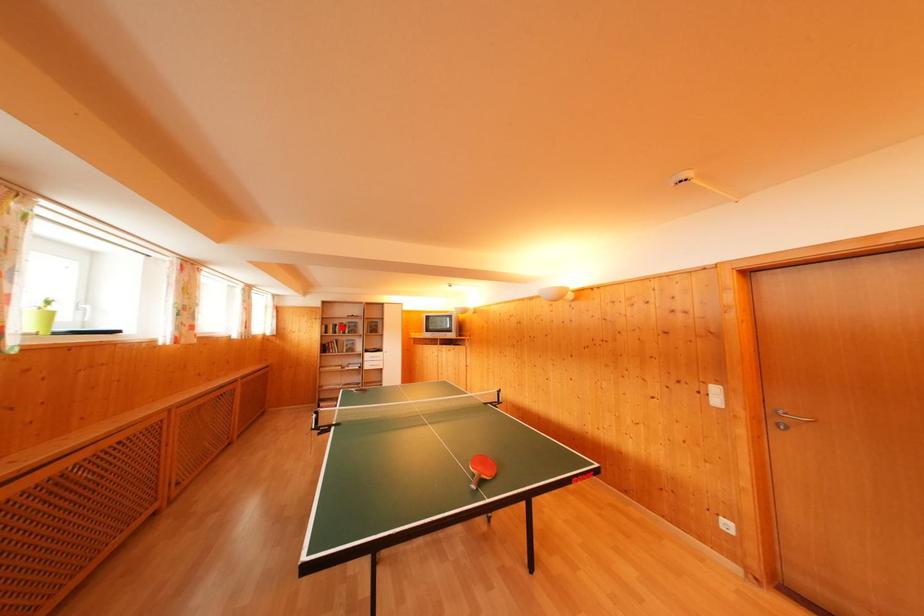
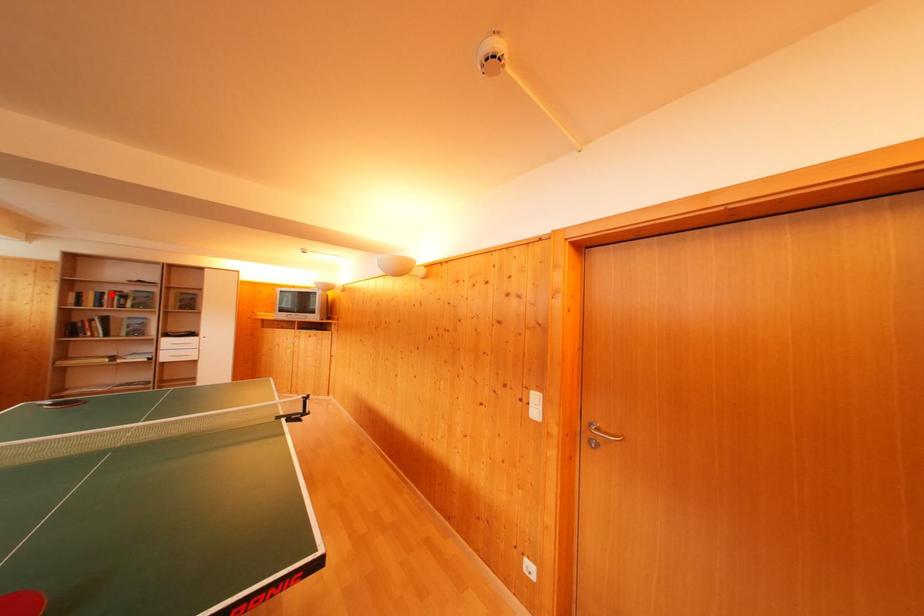
I am providing you with two images of the same scene from different viewpoints. A red point is marked on the first image and another point is marked on the second image. Are the points marked in image1 and image2 representing the same 3D position?

Yes